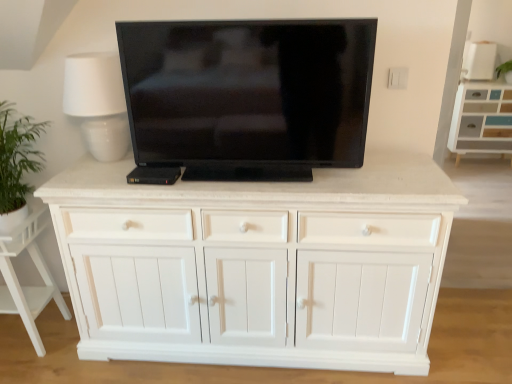
Question: Is white ceramic table lamp at upper left positioned before white wood cabinet at lower left?

Choices:
 (A) no
 (B) yes

Answer: (B)

Question: Is white ceramic table lamp at upper left further to the viewer compared to white wood cabinet at lower left?

Choices:
 (A) yes
 (B) no

Answer: (B)

Question: Does white ceramic table lamp at upper left appear on the right side of white wood cabinet at lower left?

Choices:
 (A) no
 (B) yes

Answer: (B)

Question: From a real-world perspective, is white ceramic table lamp at upper left positioned under white wood cabinet at lower left based on gravity?

Choices:
 (A) yes
 (B) no

Answer: (B)

Question: From a real-world perspective, does white ceramic table lamp at upper left stand above white wood cabinet at lower left?

Choices:
 (A) no
 (B) yes

Answer: (B)

Question: Is white ceramic table lamp at upper left shorter than white wood cabinet at lower left?

Choices:
 (A) yes
 (B) no

Answer: (A)

Question: Does black glossy tv at center have a lesser height compared to white wood cabinet at upper right?

Choices:
 (A) yes
 (B) no

Answer: (A)

Question: Is black glossy tv at center positioned far away from white wood cabinet at upper right?

Choices:
 (A) no
 (B) yes

Answer: (B)

Question: Is black glossy tv at center taller than white wood cabinet at upper right?

Choices:
 (A) no
 (B) yes

Answer: (A)

Question: From the image's perspective, would you say black glossy tv at center is shown under white wood cabinet at upper right?

Choices:
 (A) yes
 (B) no

Answer: (A)

Question: From the image's perspective, does black glossy tv at center appear higher than white wood cabinet at upper right?

Choices:
 (A) yes
 (B) no

Answer: (B)

Question: Does black glossy tv at center appear on the right side of white wood cabinet at upper right?

Choices:
 (A) no
 (B) yes

Answer: (A)

Question: Considering the relative positions of white ceramic table lamp at upper left and white wood cabinet at upper right in the image provided, is white ceramic table lamp at upper left to the left of white wood cabinet at upper right from the viewer's perspective?

Choices:
 (A) no
 (B) yes

Answer: (B)